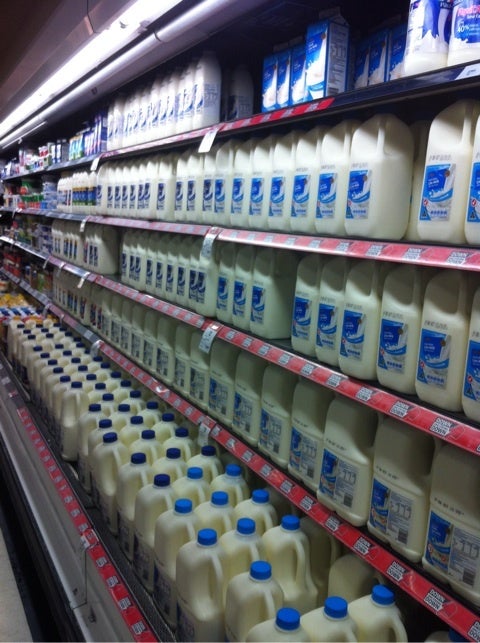
This screenshot has height=643, width=480. Identify the location of milk on bottom shelf with light blue caps. (198, 471), (234, 474), (257, 496), (219, 502), (187, 509), (206, 536), (264, 568), (291, 617), (383, 600), (335, 611).